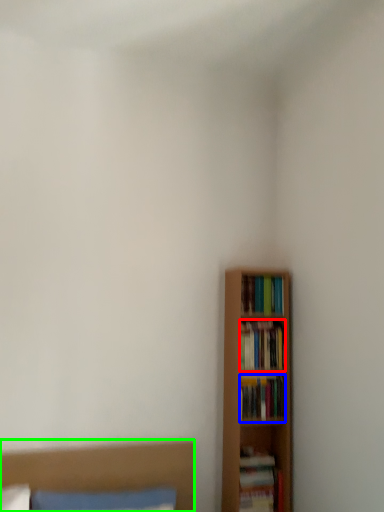
Question: Which object is the closest to the book (highlighted by a red box)? Choose among these: book (highlighted by a blue box) or bed (highlighted by a green box).

Choices:
 (A) book
 (B) bed

Answer: (A)